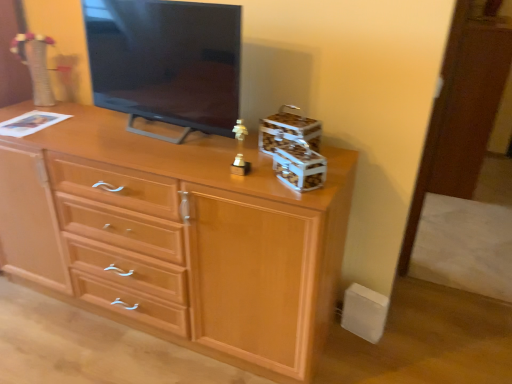
Question: Does point (291, 120) appear closer or farther from the camera than point (158, 157)?

Choices:
 (A) closer
 (B) farther

Answer: (A)

Question: Looking at their shapes, would you say wooden storage box at upper right, which ranks as the 2th storage box in front-to-back order, is wider or thinner than light wood chest of drawers at center?

Choices:
 (A) wide
 (B) thin

Answer: (B)

Question: Which of these objects is positioned farthest from the light wood chest of drawers at center?

Choices:
 (A) matte black tv at center
 (B) wooden storage box at upper right, the first storage box in the back-to-front sequence
 (C) metallic silver storage box at center-right, placed as the 1th storage box when sorted from front to back

Answer: (C)

Question: Which of these objects is positioned farthest from the wooden storage box at upper right, which ranks as the 2th storage box in front-to-back order?

Choices:
 (A) metallic silver storage box at center-right, marked as the second storage box in a back-to-front arrangement
 (B) light wood chest of drawers at center
 (C) matte black tv at center

Answer: (B)